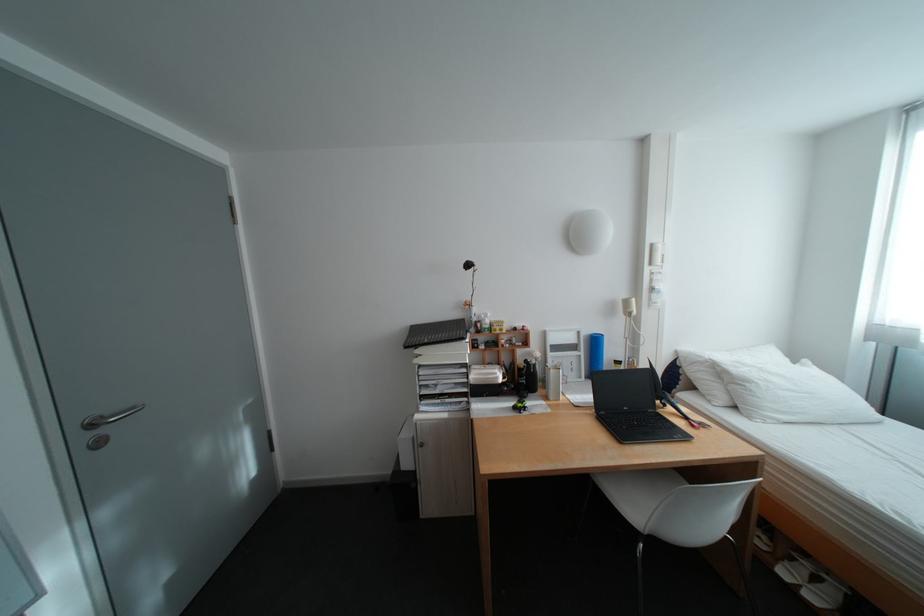
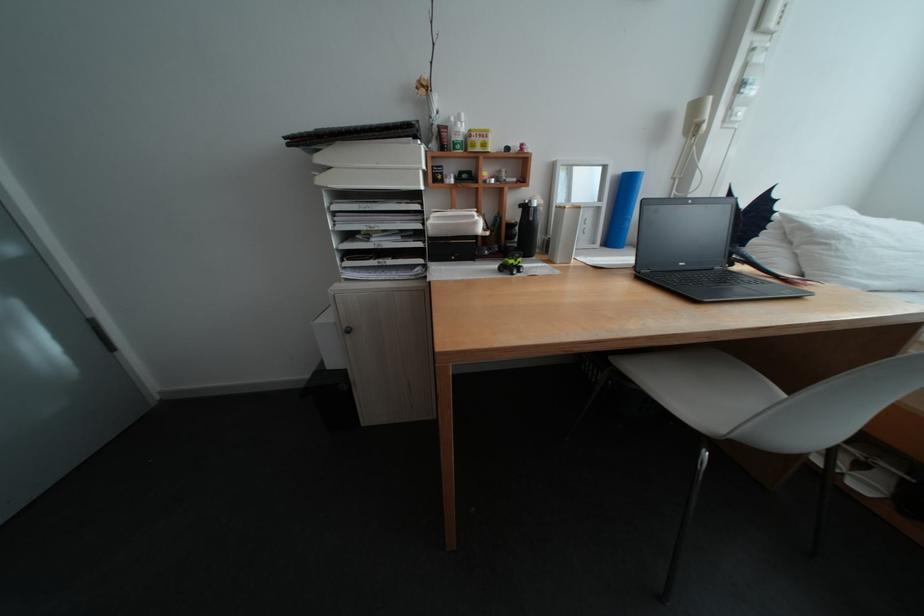
Where in the second image is the point corresponding to (x=506, y=326) from the first image?

(485, 135)